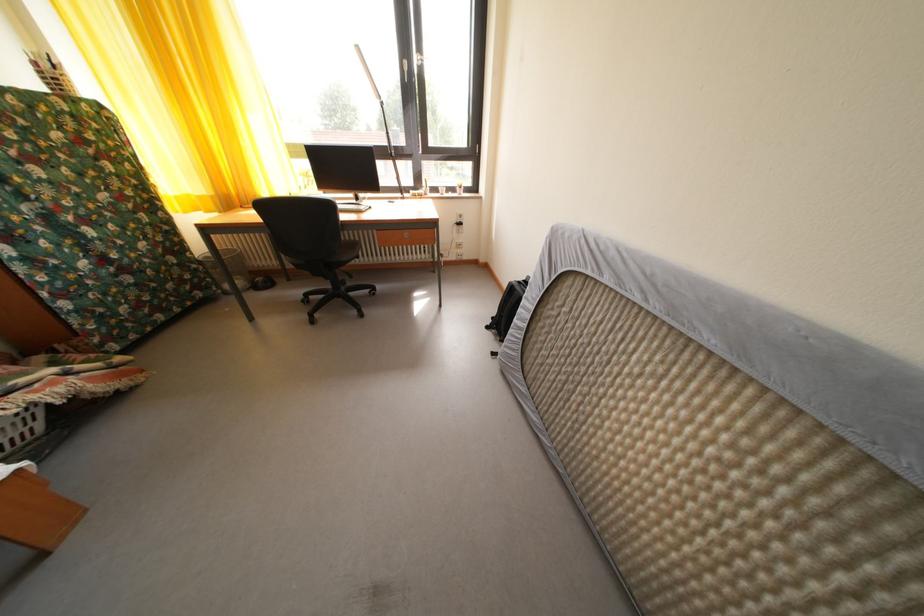
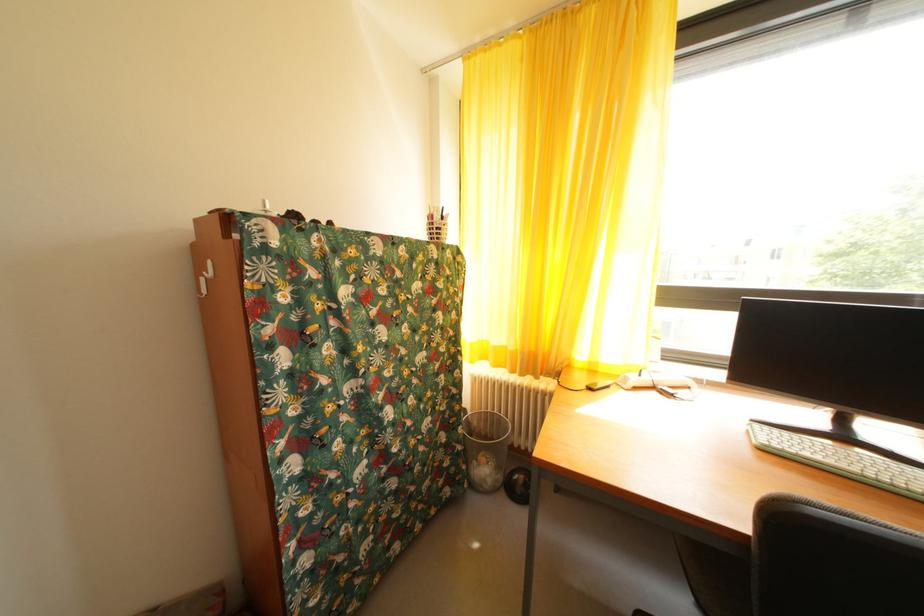
In the second image, find the point that corresponds to [203,273] in the first image.

(468, 454)